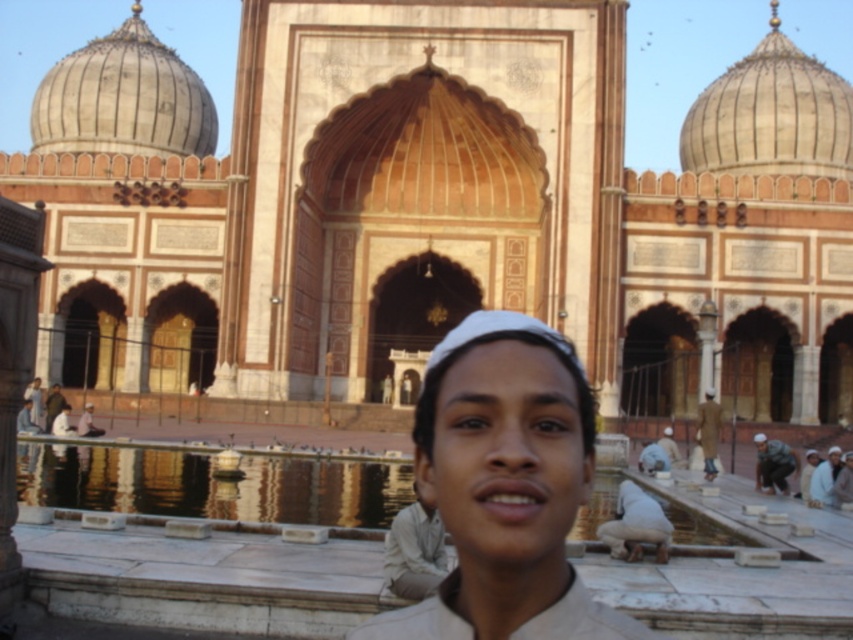
Question: Which of the following is the farthest from the observer?

Choices:
 (A) light brown leather cap at center
 (B) brown leather uniform at center
 (C) light beige fabric at center

Answer: (A)

Question: Is matte beige shirt at center smaller than light beige fabric at center?

Choices:
 (A) no
 (B) yes

Answer: (A)

Question: Can you confirm if matte beige shirt at center is wider than light beige fabric at center?

Choices:
 (A) yes
 (B) no

Answer: (A)

Question: Which object is positioned farthest from the matte beige shirt at center?

Choices:
 (A) white cotton cap at center
 (B) light beige fabric at center
 (C) green fabric shirt at lower right

Answer: (C)

Question: Is green fabric shirt at lower right below matte white cap at center?

Choices:
 (A) yes
 (B) no

Answer: (A)

Question: Estimate the real-world distances between objects in this image. Which object is farther from the white cotton cap at center?

Choices:
 (A) matte white cap at center
 (B) light beige fabric at center

Answer: (B)